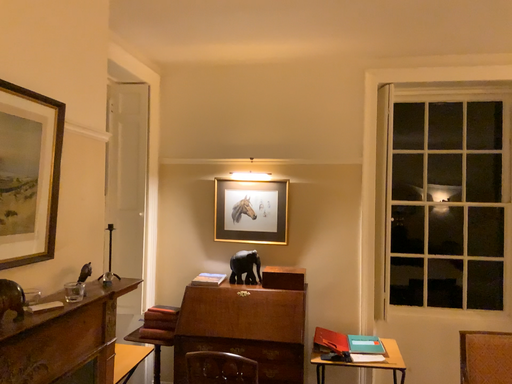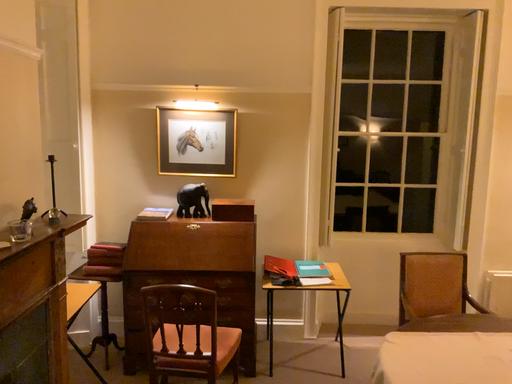
Question: How did the camera likely rotate when shooting the video?

Choices:
 (A) rotated upward
 (B) rotated downward

Answer: (B)